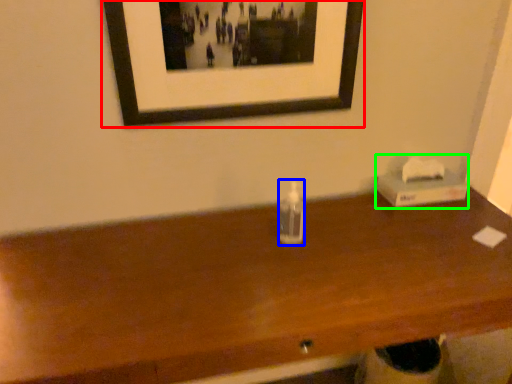
Question: Based on their relative distances, which object is farther from picture frame (highlighted by a red box)? Choose from bottle (highlighted by a blue box) and box (highlighted by a green box).

Choices:
 (A) bottle
 (B) box

Answer: (B)